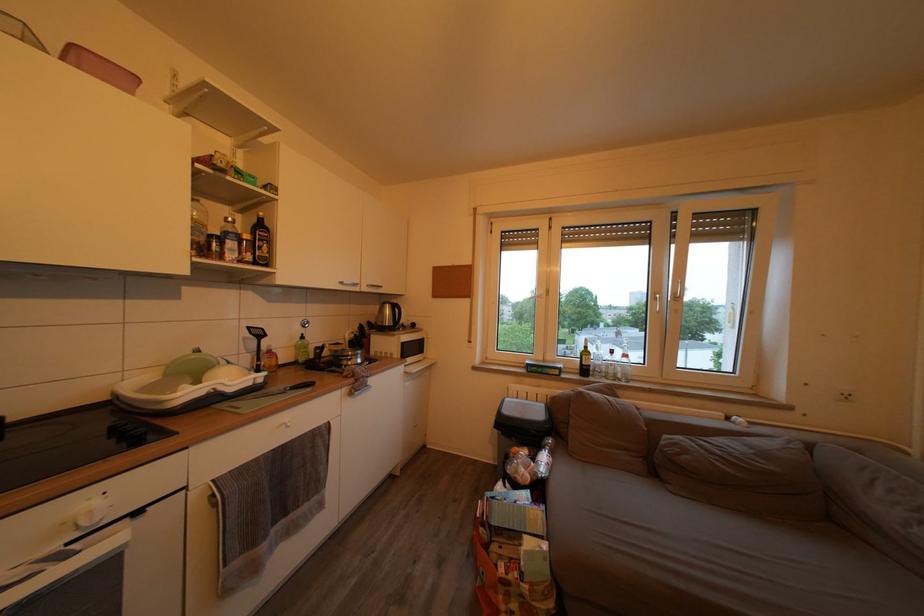
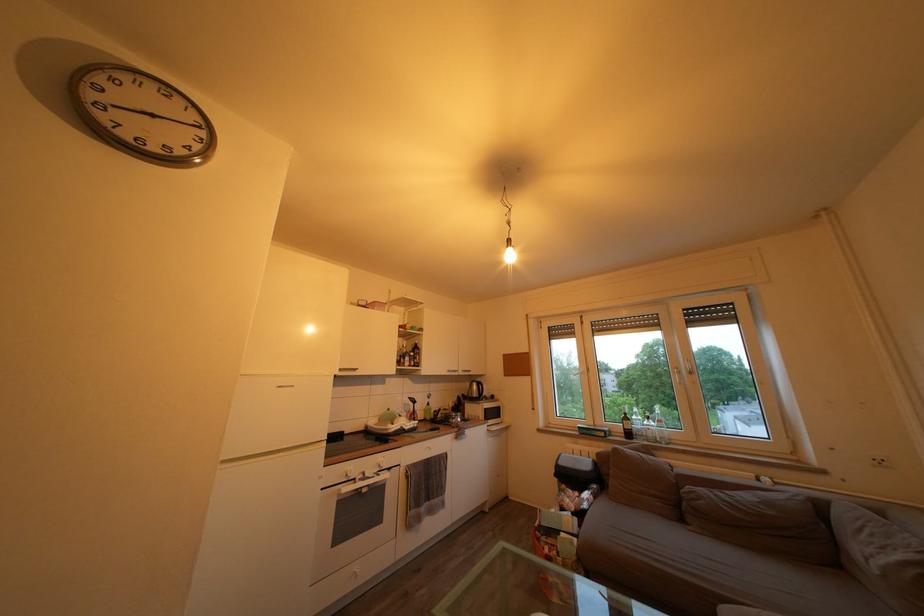
In the second image, find the point that corresponds to (395,317) in the first image.

(482, 392)